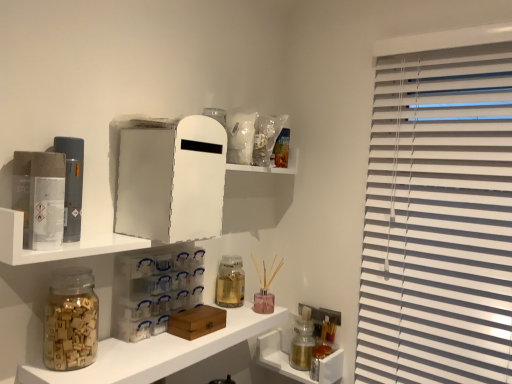
Locate an element on the screen. This screenshot has width=512, height=384. unoccupied area in front of transparent plastic drawers at center, the second cabinet in the right-to-left sequence is located at coordinates click(x=144, y=347).